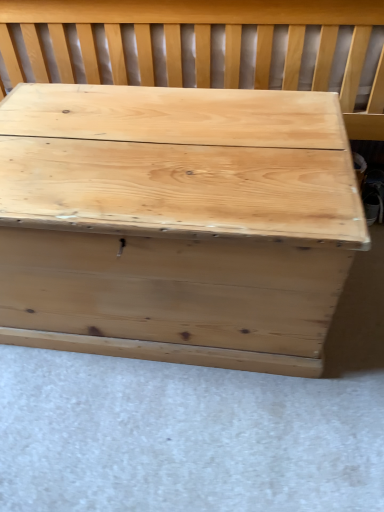
Question: Visually, is natural wood chest at center positioned to the left or to the right of natural wood trunk at center?

Choices:
 (A) right
 (B) left

Answer: (A)

Question: From the image's perspective, is natural wood chest at center above or below natural wood trunk at center?

Choices:
 (A) below
 (B) above

Answer: (B)

Question: Is natural wood chest at center inside or outside of natural wood trunk at center?

Choices:
 (A) inside
 (B) outside

Answer: (B)

Question: Which is correct: natural wood trunk at center is inside natural wood chest at center, or outside of it?

Choices:
 (A) inside
 (B) outside

Answer: (B)

Question: Does point (317, 92) appear closer or farther from the camera than point (253, 69)?

Choices:
 (A) closer
 (B) farther

Answer: (A)

Question: Based on their positions, is natural wood trunk at center located to the left or right of natural wood chest at center?

Choices:
 (A) right
 (B) left

Answer: (B)

Question: Is natural wood trunk at center bigger or smaller than natural wood chest at center?

Choices:
 (A) big
 (B) small

Answer: (B)